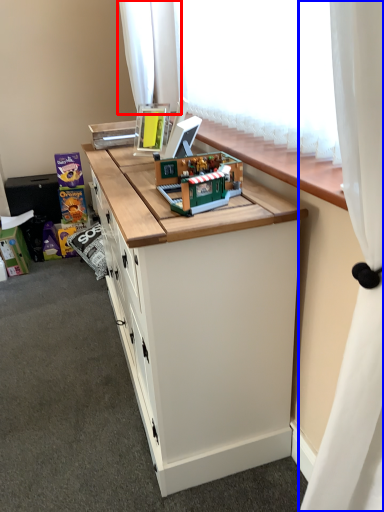
Question: Which point is closer to the camera, curtain (highlighted by a red box) or curtain (highlighted by a blue box)?

Choices:
 (A) curtain
 (B) curtain

Answer: (B)